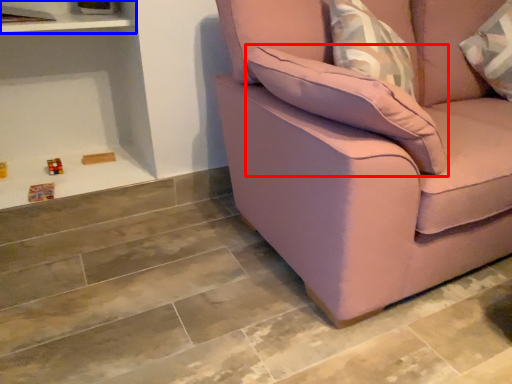
Question: Which of the following is the farthest to the observer, pillow (highlighted by a red box) or shelf (highlighted by a blue box)?

Choices:
 (A) pillow
 (B) shelf

Answer: (B)